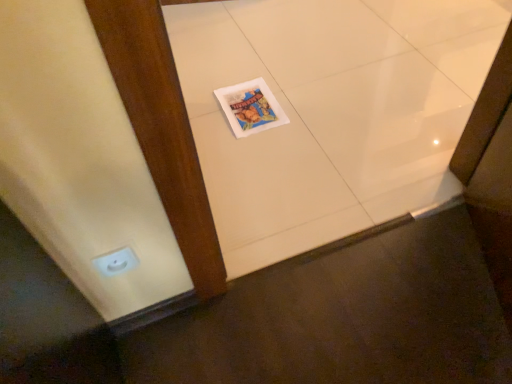
Find the location of a particular element. vacant space to the right of matte paper magazine at center is located at coordinates (312, 98).